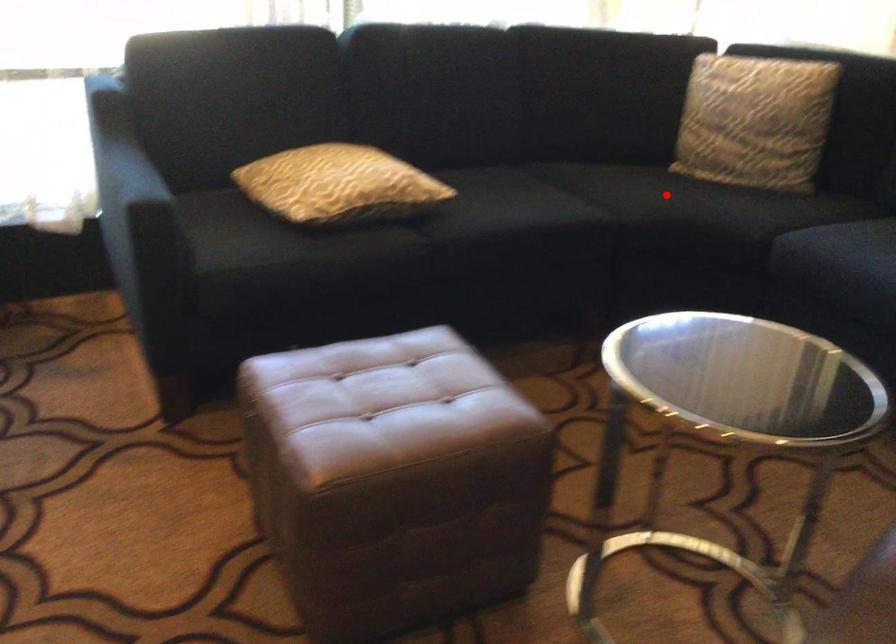
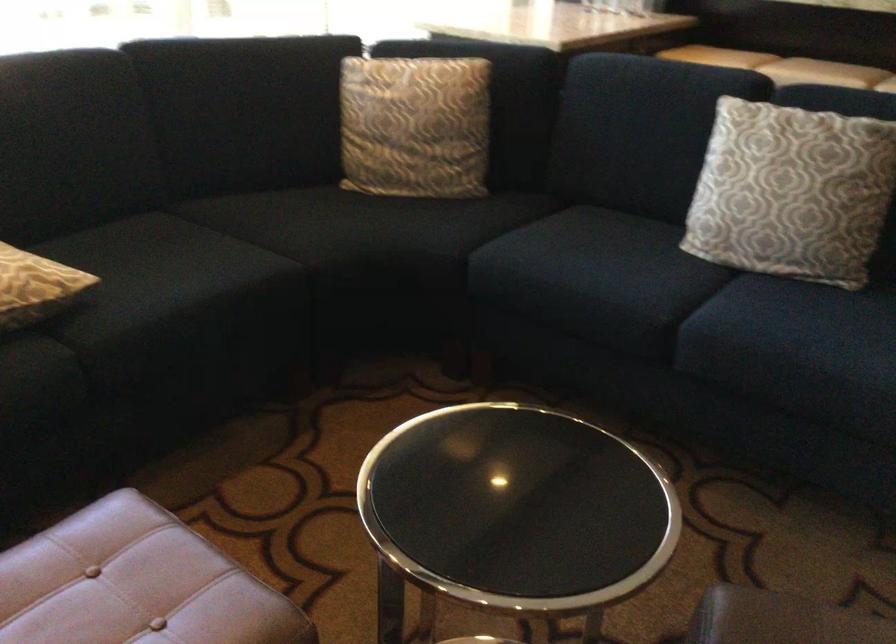
Question: I am providing you with two images of the same scene from different viewpoints. In image1, a red point is highlighted. Considering the same 3D point in image2, which of the following is correct?

Choices:
 (A) It is closer
 (B) It is farther

Answer: (A)